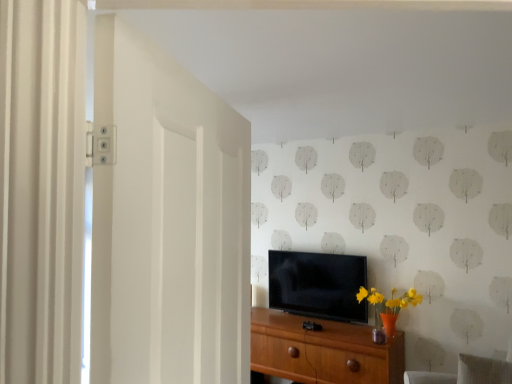
Question: Is white matte door at left shorter than wooden chest of drawers at center?

Choices:
 (A) yes
 (B) no

Answer: (B)

Question: Is white matte door at left outside of wooden chest of drawers at center?

Choices:
 (A) yes
 (B) no

Answer: (A)

Question: Is white matte door at left in contact with wooden chest of drawers at center?

Choices:
 (A) no
 (B) yes

Answer: (A)

Question: Is white matte door at left positioned far away from wooden chest of drawers at center?

Choices:
 (A) yes
 (B) no

Answer: (A)

Question: Can you confirm if white matte door at left is positioned to the right of wooden chest of drawers at center?

Choices:
 (A) no
 (B) yes

Answer: (A)

Question: Considering the relative positions of white matte door at left and wooden chest of drawers at center in the image provided, is white matte door at left to the left of wooden chest of drawers at center from the viewer's perspective?

Choices:
 (A) no
 (B) yes

Answer: (B)

Question: Is gray fabric swivel chair at lower right wider than black glossy tv at center?

Choices:
 (A) no
 (B) yes

Answer: (B)

Question: Does gray fabric swivel chair at lower right have a greater height compared to black glossy tv at center?

Choices:
 (A) yes
 (B) no

Answer: (B)

Question: Is gray fabric swivel chair at lower right outside of black glossy tv at center?

Choices:
 (A) yes
 (B) no

Answer: (A)

Question: Does gray fabric swivel chair at lower right touch black glossy tv at center?

Choices:
 (A) no
 (B) yes

Answer: (A)

Question: From the image's perspective, does gray fabric swivel chair at lower right appear higher than black glossy tv at center?

Choices:
 (A) no
 (B) yes

Answer: (A)

Question: Does gray fabric swivel chair at lower right appear on the right side of black glossy tv at center?

Choices:
 (A) yes
 (B) no

Answer: (A)

Question: Considering the relative positions of wooden chest of drawers at center and gray fabric swivel chair at lower right in the image provided, is wooden chest of drawers at center to the left of gray fabric swivel chair at lower right from the viewer's perspective?

Choices:
 (A) no
 (B) yes

Answer: (B)